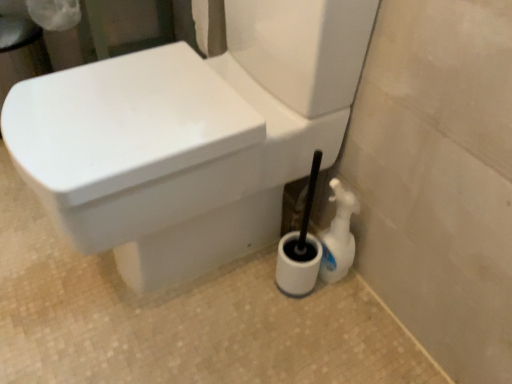
Where is `free space in front of white glossy toilet at center`? free space in front of white glossy toilet at center is located at coordinates (180, 342).